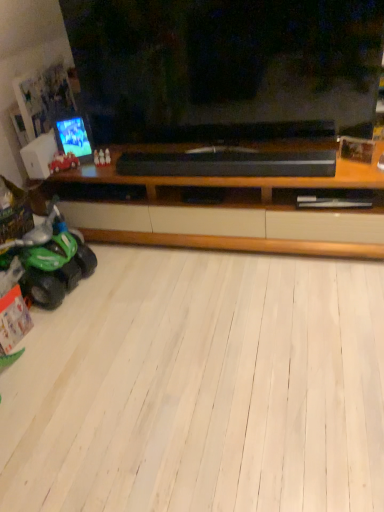
Question: In the image, is green plastic toy car at lower left, which appears as the 2th land vehicle when viewed from the top, positioned in front of or behind shiny plastic phone at left?

Choices:
 (A) behind
 (B) front

Answer: (B)

Question: Which is correct: green plastic toy car at lower left, which is the first land vehicle from bottom to top, is inside shiny plastic phone at left, or outside of it?

Choices:
 (A) outside
 (B) inside

Answer: (A)

Question: Which object is positioned closest to the green plastic toy car at lower left, which appears as the 2th land vehicle when viewed from the top?

Choices:
 (A) white plastic speaker at left
 (B) shiny red toy car at left, the first land vehicle viewed from the top
 (C) shiny plastic phone at left

Answer: (A)

Question: Considering the real-world distances, which object is farthest from the white plastic speaker at left?

Choices:
 (A) shiny red toy car at left, which appears as the 2th land vehicle when ordered from the bottom
 (B) shiny plastic phone at left
 (C) green plastic toy car at lower left, which appears as the 2th land vehicle when viewed from the top

Answer: (C)